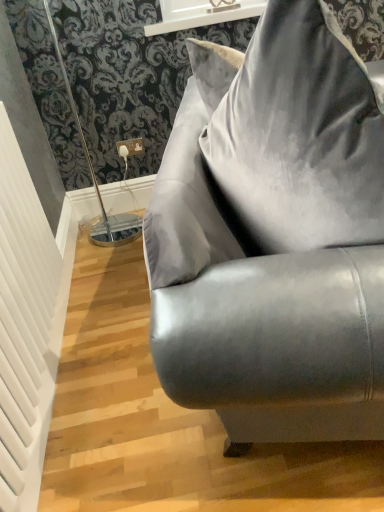
Identify the location of satin gray couch at center. (274, 237).

Find the location of `white glossy window sill at upper center`. white glossy window sill at upper center is located at coordinates (202, 14).

This screenshot has width=384, height=512. I want to click on white textured radiator at left, so click(x=25, y=326).

Identify the location of satin gray couch at center. (274, 237).

You are a GUI agent. You are given a task and a screenshot of the screen. Output one action in this format:
    pyautogui.click(x=<x>, y=<y>)
    Task: Click on the studio couch on the right of white glossy window sill at upper center
    
    Given the screenshot: What is the action you would take?
    pyautogui.click(x=274, y=237)

Choose the correct answer: Is satin gray couch at center inside white glossy window sill at upper center or outside it?

→ satin gray couch at center is not inside white glossy window sill at upper center, it's outside.

Does point (357, 58) lie in front of point (169, 24)?

Yes, point (357, 58) is closer to viewer.

Considering the sizes of satin gray couch at center and white textured radiator at left in the image, is satin gray couch at center bigger or smaller than white textured radiator at left?

In the image, satin gray couch at center appears to be larger than white textured radiator at left.

How much distance is there between satin gray couch at center and white textured radiator at left?

satin gray couch at center is 24.33 inches away from white textured radiator at left.

Is satin gray couch at center positioned before white textured radiator at left?

Yes.

In order to click on studio couch above the white textured radiator at left (from a real-world perspective) in this screenshot , I will do `click(274, 237)`.

At what (x,y) coordinates should I click in order to perform the action: click on window sill above the satin gray couch at center (from the image's perspective). Please return your answer as a coordinate pair (x, y). This screenshot has height=512, width=384. Looking at the image, I should click on (202, 14).

Looking at the image, does white glossy window sill at upper center seem bigger or smaller compared to satin gray couch at center?

In the image, white glossy window sill at upper center appears to be smaller than satin gray couch at center.

Which object is further away from the camera, white glossy window sill at upper center or satin gray couch at center?

white glossy window sill at upper center is more distant.

Is the surface of white glossy window sill at upper center in direct contact with satin gray couch at center?

They are not placed beside each other.

Can you tell me how much white textured radiator at left and white glossy window sill at upper center differ in facing direction?

90.1 degrees separate the facing orientations of white textured radiator at left and white glossy window sill at upper center.

Consider the image. Which is correct: white textured radiator at left is inside white glossy window sill at upper center, or outside of it?

white textured radiator at left is located beyond the bounds of white glossy window sill at upper center.

Is white textured radiator at left beside white glossy window sill at upper center?

No, white textured radiator at left is not in contact with white glossy window sill at upper center.

From a real-world perspective, who is located lower, white textured radiator at left or white glossy window sill at upper center?

white textured radiator at left, from a real-world perspective.

How many degrees apart are the facing directions of white textured radiator at left and satin gray couch at center?

There is a 12.7-degree angle between the facing directions of white textured radiator at left and satin gray couch at center.

Is white textured radiator at left oriented away from satin gray couch at center?

That's not correct — white textured radiator at left is not looking away from satin gray couch at center.

The image size is (384, 512). What are the coordinates of `radiator below the satin gray couch at center (from the image's perspective)` in the screenshot? It's located at (25, 326).

Based on the photo, is white textured radiator at left surrounded by white glossy window sill at upper center?

No, white textured radiator at left is not surrounded by white glossy window sill at upper center.

Is white glossy window sill at upper center to the right of white textured radiator at left from the viewer's perspective?

Indeed, white glossy window sill at upper center is positioned on the right side of white textured radiator at left.

From a real-world perspective, relative to white textured radiator at left, is white glossy window sill at upper center vertically above or below?

white glossy window sill at upper center is situated higher than white textured radiator at left in the real world.

In terms of width, does white glossy window sill at upper center look wider or thinner when compared to white textured radiator at left?

In the image, white glossy window sill at upper center appears to be wider than white textured radiator at left.

At what (x,y) coordinates should I click in order to perform the action: click on studio couch below the white glossy window sill at upper center (from a real-world perspective). Please return your answer as a coordinate pair (x, y). Looking at the image, I should click on (274, 237).

In order to click on radiator on the left side of satin gray couch at center in this screenshot , I will do `click(25, 326)`.

When comparing their distances from white textured radiator at left, does satin gray couch at center or white glossy window sill at upper center seem closer?

satin gray couch at center lies closer to white textured radiator at left than the other object.

Consider the image. When comparing their distances from satin gray couch at center, does white textured radiator at left or white glossy window sill at upper center seem closer?

white textured radiator at left is positioned closer to the anchor satin gray couch at center.

Estimate the real-world distances between objects in this image. Which object is closer to white glossy window sill at upper center, white textured radiator at left or satin gray couch at center?

Among the two, satin gray couch at center is located nearer to white glossy window sill at upper center.

Which object lies nearer to the anchor point white textured radiator at left, white glossy window sill at upper center or satin gray couch at center?

satin gray couch at center.

Based on their spatial positions, is satin gray couch at center or white textured radiator at left further from white glossy window sill at upper center?

white textured radiator at left is further to white glossy window sill at upper center.

When comparing their distances from satin gray couch at center, does white glossy window sill at upper center or white textured radiator at left seem further?

Based on the image, white glossy window sill at upper center appears to be further to satin gray couch at center.

This screenshot has width=384, height=512. I want to click on radiator positioned between satin gray couch at center and white glossy window sill at upper center from near to far, so click(x=25, y=326).